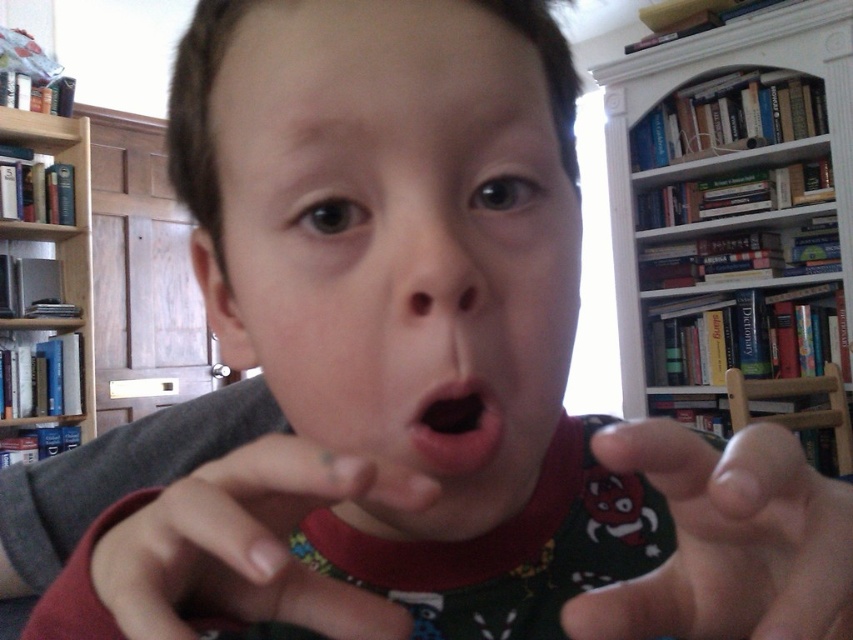
Does smooth skin face at center lie behind smooth skin hand at center?

That is True.

Who is lower down, smooth skin face at center or smooth skin hand at center?

Positioned lower is smooth skin hand at center.

Based on the photo, who is more forward, (372, 132) or (120, 616)?

Point (120, 616) is in front.

Locate an element on the screen. The width and height of the screenshot is (853, 640). smooth skin face at center is located at coordinates (396, 234).

Does point (332, 484) come farther from viewer compared to point (438, 461)?

That is False.

Is smooth skin hand at center thinner than black matte mouth at center?

No, smooth skin hand at center is not thinner than black matte mouth at center.

Is point (349, 621) behind point (469, 449)?

No.

What are the coordinates of `smooth skin hand at center` in the screenshot? It's located at (248, 545).

Who is higher up, blue hardcover books at left or black matte mouth at center?

blue hardcover books at left is higher up.

Who is positioned more to the left, blue hardcover books at left or black matte mouth at center?

Positioned to the left is blue hardcover books at left.

Which is behind, point (51, 136) or point (436, 474)?

The point (51, 136) is more distant.

The height and width of the screenshot is (640, 853). Identify the location of blue hardcover books at left. (44, 285).